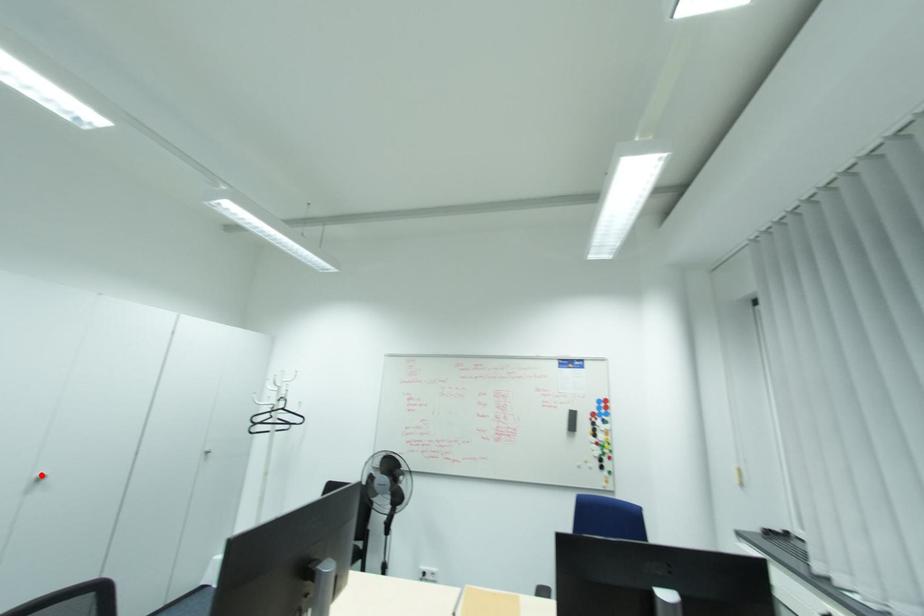
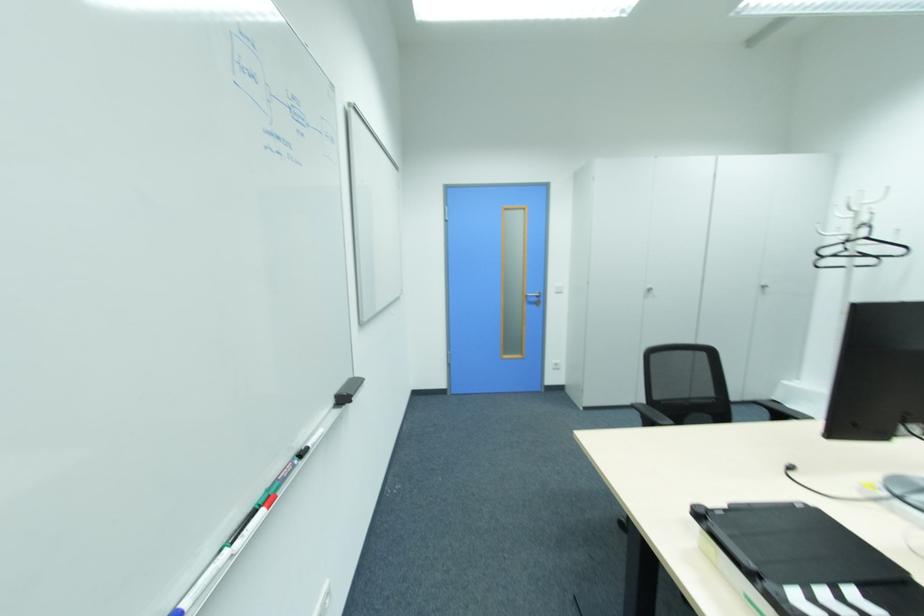
In the second image, find the point that corresponds to the highlighted location in the first image.

(650, 288)